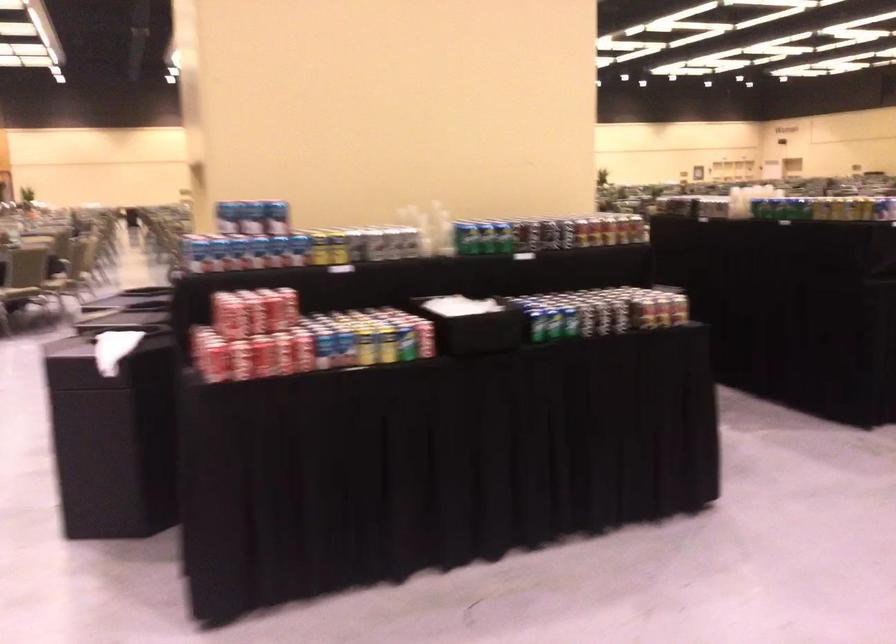
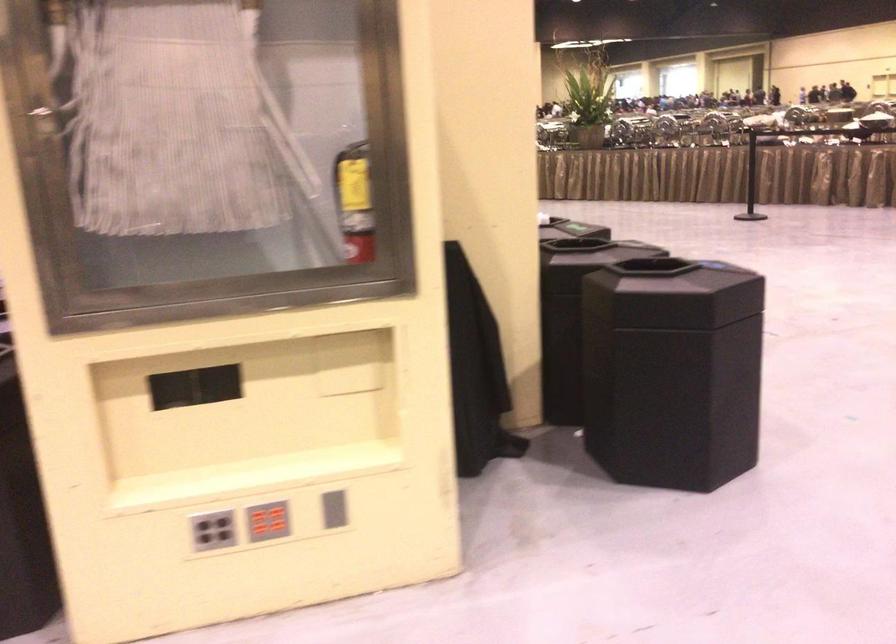
Question: I am providing you with two images of the same scene from different viewpoints. Which of the following objects are not visible in image2?

Choices:
 (A) blue soda can
 (B) small white bottle
 (C) grey button panel
 (D) red button panel

Answer: (A)